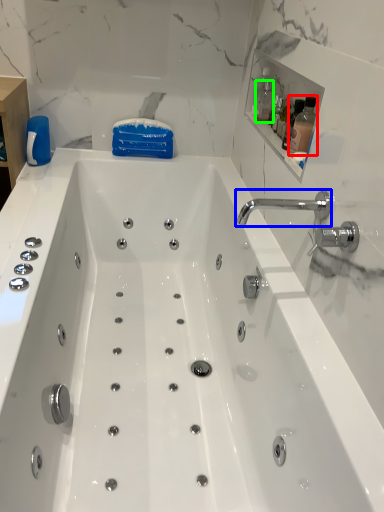
Question: Based on their relative distances, which object is farther from bottle (highlighted by a red box)? Choose from tap (highlighted by a blue box) and bottle (highlighted by a green box).

Choices:
 (A) tap
 (B) bottle

Answer: (B)